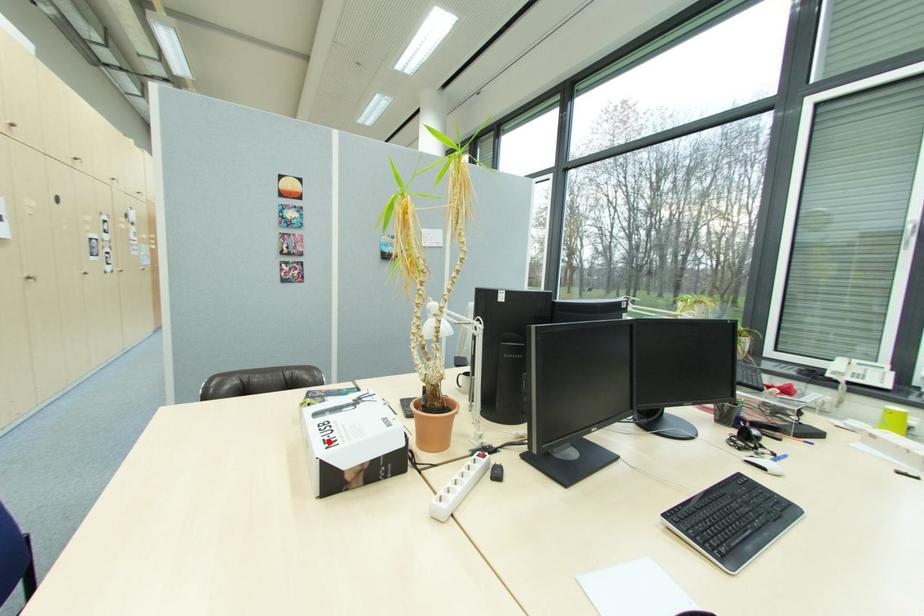
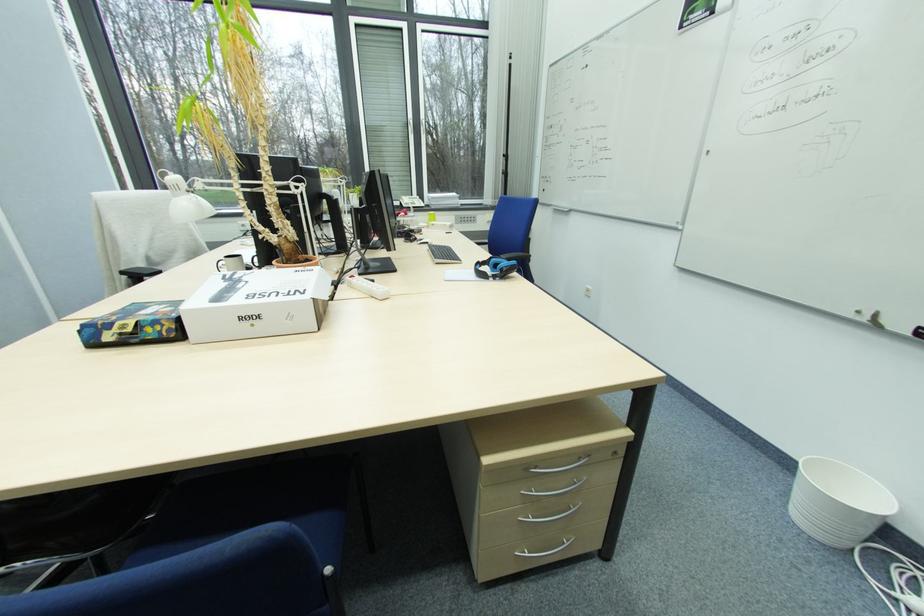
Where in the second image is the point corresponding to the highlighted location from the first image?

(292, 296)